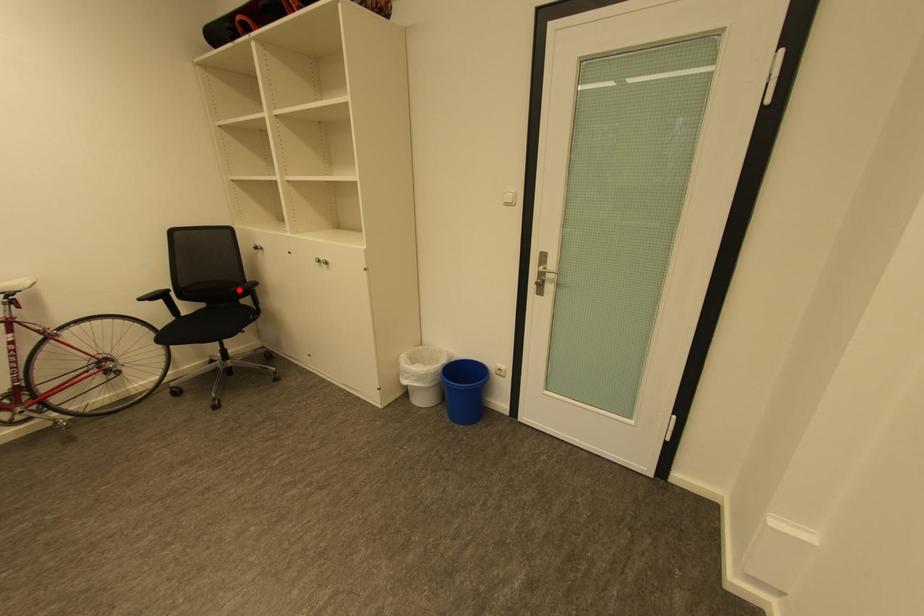
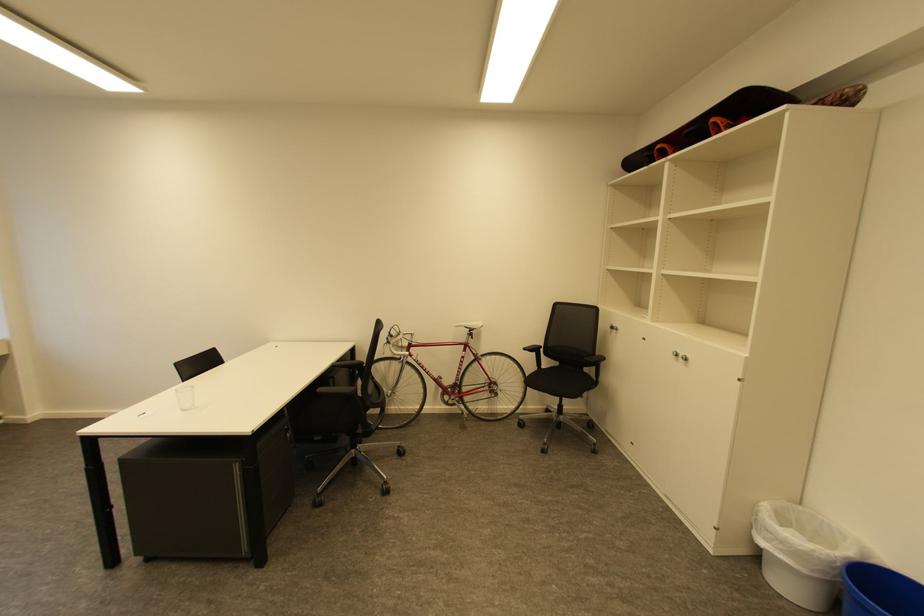
Find the pixel in the second image that matches the highlighted location in the first image.

(591, 360)